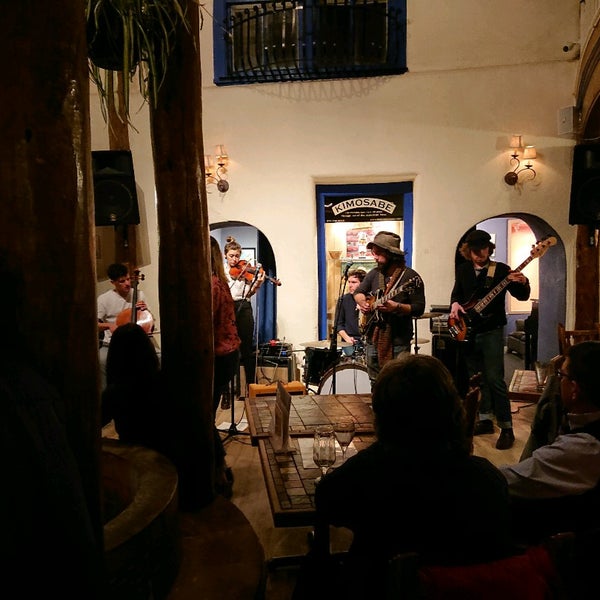
Image resolution: width=600 pixels, height=600 pixels. In order to click on tile tables in this screenshot , I will do `click(298, 462)`, `click(310, 402)`.